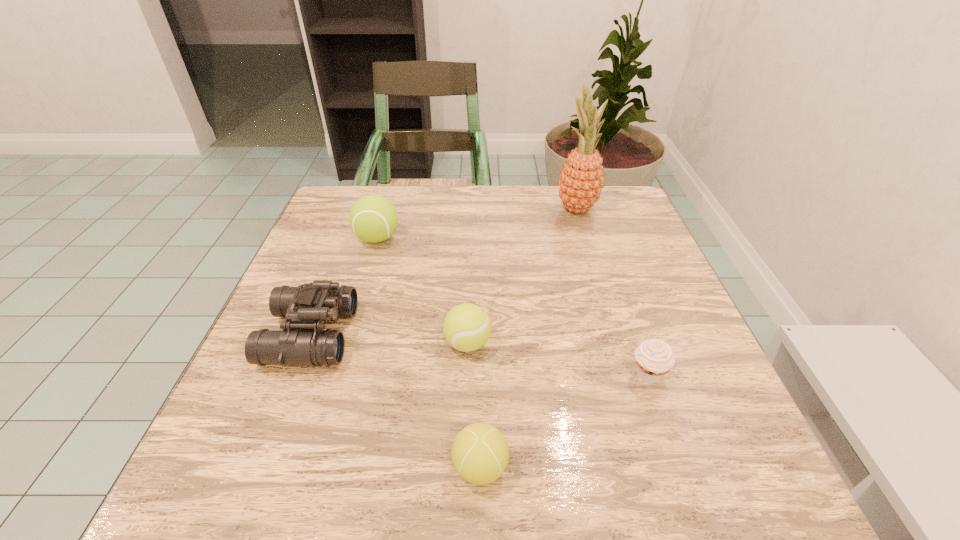
This screenshot has width=960, height=540. I want to click on the farthest object, so click(581, 180).

Where is `the tallest object`? the tallest object is located at coordinates (581, 180).

In order to click on the fifth nearest object in this screenshot , I will do `click(373, 218)`.

Where is `the leftmost tennis ball`? Image resolution: width=960 pixels, height=540 pixels. the leftmost tennis ball is located at coordinates (373, 218).

The image size is (960, 540). Identify the location of binoculars. (303, 342).

Identify the location of the second nearest tennis ball. This screenshot has height=540, width=960. (467, 327).

Locate an element on the screen. This screenshot has width=960, height=540. muffin is located at coordinates (654, 357).

Identify the location of the nearest tennis ball. The height and width of the screenshot is (540, 960). (480, 453).

Identify the location of blank area located 0.350m on the front of the pineapple. Image resolution: width=960 pixels, height=540 pixels. (611, 320).

Where is `blank area located 0.260m on the right of the farthest tennis ball`? The height and width of the screenshot is (540, 960). blank area located 0.260m on the right of the farthest tennis ball is located at coordinates (506, 238).